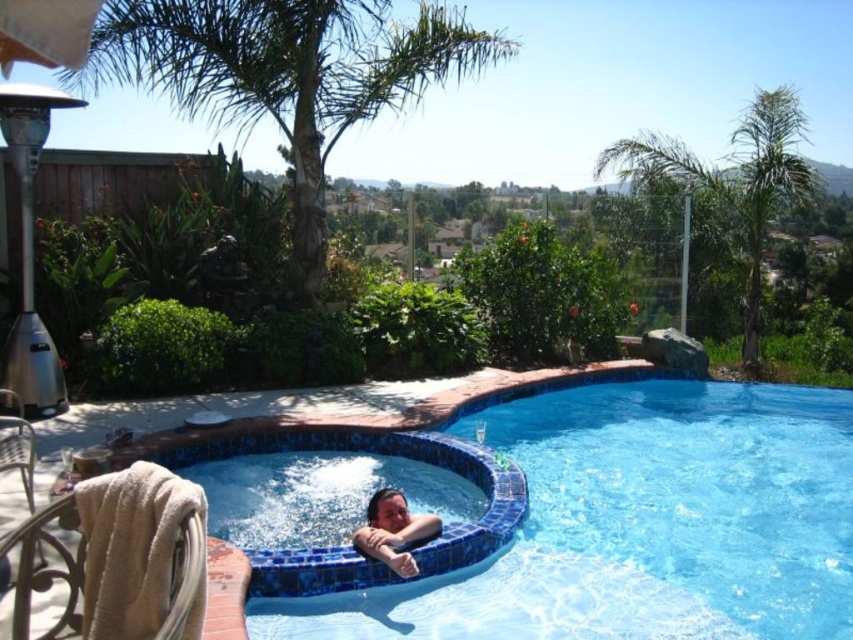
You are a lifeguard on duty and need to ensure safety. The blue mosaic tile swimming pool at center and the smooth skin child at lower center are both in your view. Which object is larger in size?

The smooth skin child at lower center is larger than the blue mosaic tile swimming pool at center according to the description.

You are standing at the entrance of the pool area and want to locate the blue mosaic tile swimming pool at center. According to the coordinates provided, where should you look?

The blue mosaic tile swimming pool at center is located at coordinates point (662, 422).

You are standing at the edge of the pool and see two points in the scene. The first point is at coordinate point (712, 508) and the second is at point (395, 529). Which point is closer to you?

Point (395, 529) is closer to you because the description states that point (712, 508) is further to the camera than point (395, 529).